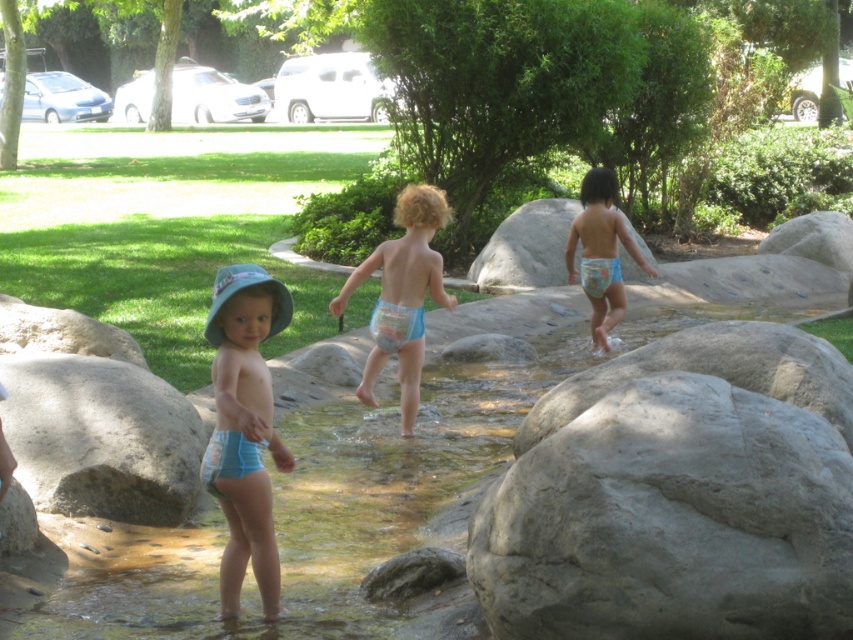
Looking at this image, who is higher up, blue fabric hat at left or blue cloth diaper at center?

blue cloth diaper at center is above.

Where is `blue fabric hat at left`? The width and height of the screenshot is (853, 640). blue fabric hat at left is located at coordinates (244, 428).

Locate an element on the screen. blue fabric hat at left is located at coordinates (244, 428).

The width and height of the screenshot is (853, 640). In order to click on blue fabric hat at left in this screenshot , I will do `click(244, 428)`.

Does blue fabric hat at left have a lesser width compared to blue fabric diaper at center?

Yes.

Between blue fabric hat at left and blue fabric diaper at center, which one appears on the left side from the viewer's perspective?

blue fabric hat at left

Is point (236, 372) positioned in front of point (585, 204)?

That is True.

Locate an element on the screen. The width and height of the screenshot is (853, 640). blue fabric hat at left is located at coordinates (244, 428).

Between gray rough boulder at lower left and blue fabric diaper at center, which one is positioned lower?

gray rough boulder at lower left

Does gray rough boulder at lower left have a larger size compared to blue fabric diaper at center?

No.

At what (x,y) coordinates should I click in order to perform the action: click on gray rough boulder at lower left. Please return your answer as a coordinate pair (x, y). The image size is (853, 640). Looking at the image, I should click on (x=102, y=438).